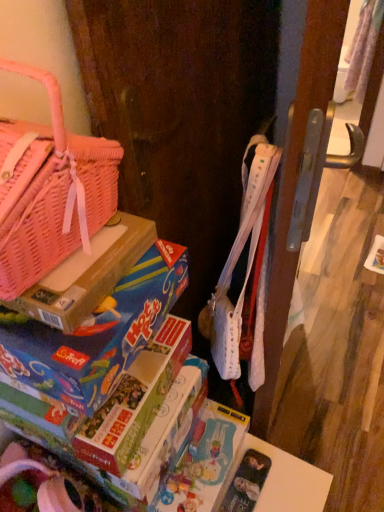
Question: In terms of size, does cardboard box at left appear bigger or smaller than pink woven basket at upper left?

Choices:
 (A) big
 (B) small

Answer: (B)

Question: Is cardboard box at left to the left or to the right of pink woven basket at upper left in the image?

Choices:
 (A) right
 (B) left

Answer: (A)

Question: Estimate the real-world distances between objects in this image. Which object is farther from the matte cardboard book at lower left?

Choices:
 (A) cardboard box at left
 (B) pink woven basket at upper left

Answer: (B)

Question: Which of these objects is positioned closest to the cardboard box at left?

Choices:
 (A) matte cardboard book at lower left
 (B) pink woven basket at upper left

Answer: (B)